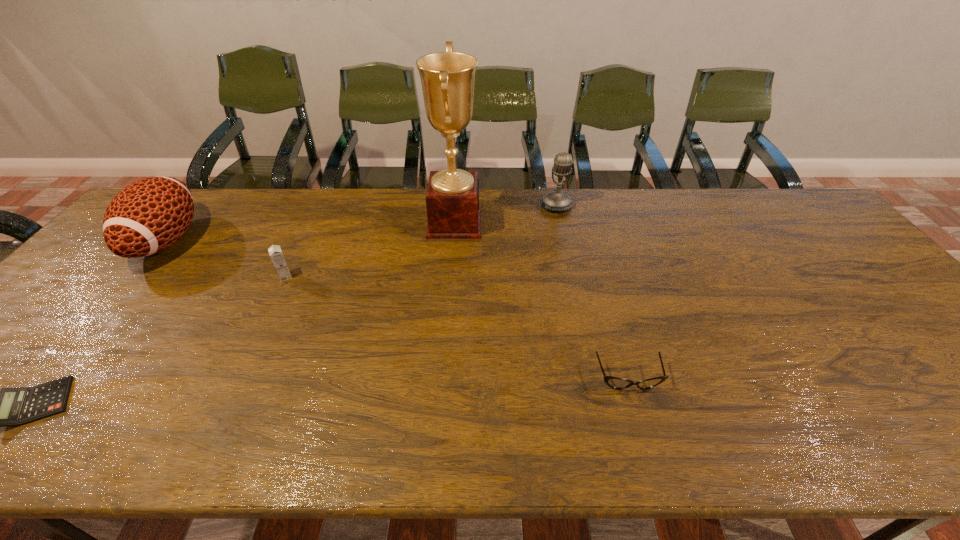
Where is `free space between the tallest object and the fifth tallest object`? The height and width of the screenshot is (540, 960). free space between the tallest object and the fifth tallest object is located at coordinates (541, 300).

You are a GUI agent. You are given a task and a screenshot of the screen. Output one action in this format:
    pyautogui.click(x=<x>, y=<y>)
    Task: Click on the blank region between the third shortest object and the football
    
    Given the screenshot: What is the action you would take?
    pyautogui.click(x=226, y=259)

You are a GUI agent. You are given a task and a screenshot of the screen. Output one action in this format:
    pyautogui.click(x=<x>, y=<y>)
    Task: Click on the free space between the football and the fourth object from right to left
    This screenshot has width=960, height=540.
    Given the screenshot: What is the action you would take?
    pyautogui.click(x=226, y=259)

The image size is (960, 540). I want to click on free space between the football and the microphone, so click(362, 223).

Locate an element on the screen. The height and width of the screenshot is (540, 960). vacant space in between the second shortest object and the tallest object is located at coordinates (541, 300).

Locate an element on the screen. Image resolution: width=960 pixels, height=540 pixels. free space between the microphone and the football is located at coordinates (362, 223).

This screenshot has height=540, width=960. I want to click on vacant space that's between the fifth tallest object and the microphone, so click(x=592, y=292).

This screenshot has width=960, height=540. What are the coordinates of `object identified as the second closest to the calculator` in the screenshot? It's located at (275, 252).

Locate an element on the screen. This screenshot has height=540, width=960. object that is the third closest to the calculator is located at coordinates (452, 200).

The height and width of the screenshot is (540, 960). I want to click on vacant space that satisfies the following two spatial constraints: 1. on the front-facing side of the microphone; 2. on the plaque of the tallest object, so tap(561, 222).